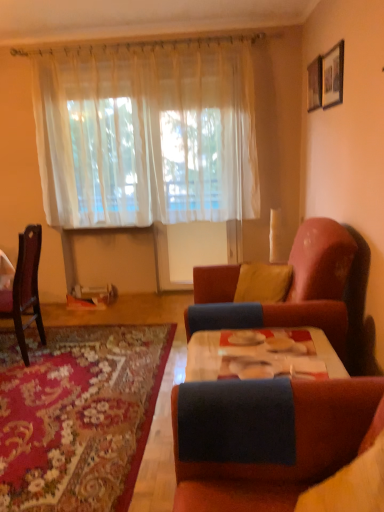
Question: Is dark wood chair at left inside or outside of wooden picture frame at upper right, arranged as the first picture frame when viewed from the front?

Choices:
 (A) inside
 (B) outside

Answer: (B)

Question: Based on their positions, is dark wood chair at left located to the left or right of wooden picture frame at upper right, arranged as the first picture frame when viewed from the front?

Choices:
 (A) left
 (B) right

Answer: (A)

Question: Which object is positioned closest to the wooden picture frame at upper right, which appears as the second picture frame when viewed from the front?

Choices:
 (A) dark wood chair at left
 (B) velvet pink couch at right
 (C) sheer white curtain at upper center
 (D) yellow fabric pillow at center
 (E) carpeted rug at lower left

Answer: (C)

Question: Which object is positioned farthest from the yellow fabric pillow at center?

Choices:
 (A) wooden picture frame at upper right, which appears as the second picture frame when viewed from the front
 (B) carpeted rug at lower left
 (C) velvet pink couch at right
 (D) sheer white curtain at upper center
 (E) wooden picture frame at upper right, acting as the 2th picture frame starting from the back

Answer: (D)